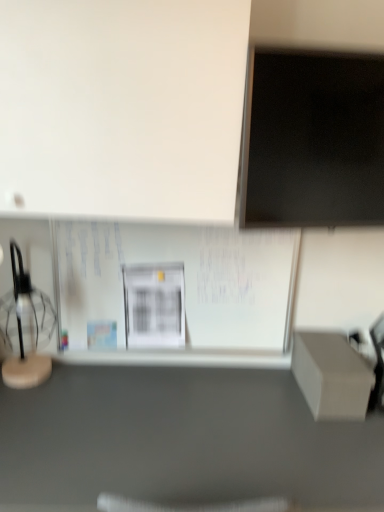
Find the location of a particular element. This screenshot has width=384, height=512. unoccupied region to the right of translucent glass table lamp at left is located at coordinates (82, 386).